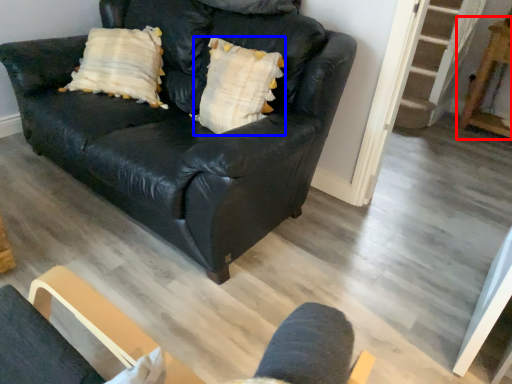
Question: Which object appears closest to the camera in this image, table (highlighted by a red box) or pillow (highlighted by a blue box)?

Choices:
 (A) table
 (B) pillow

Answer: (B)